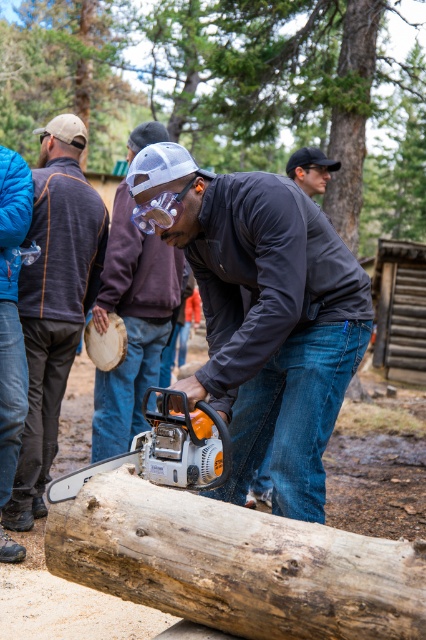
Question: Which point is closer to the camera?

Choices:
 (A) matte white helmet at center
 (B) matte black chainsaw at left
 (C) green textured log at center
 (D) dark gray jacket at center

Answer: (B)

Question: Does green textured log at center appear on the left side of matte black chainsaw at center?

Choices:
 (A) no
 (B) yes

Answer: (B)

Question: Is matte black chainsaw at left closer to camera compared to orange metallic chainsaw at lower center?

Choices:
 (A) no
 (B) yes

Answer: (A)

Question: Estimate the real-world distances between objects in this image. Which object is farther from the dark gray jacket at center?

Choices:
 (A) matte white helmet at center
 (B) green textured log at center

Answer: (B)

Question: Can you confirm if matte black chainsaw at left is wider than matte white helmet at center?

Choices:
 (A) yes
 (B) no

Answer: (B)

Question: Estimate the real-world distances between objects in this image. Which object is closer to the green textured log at center?

Choices:
 (A) weathered brown log at center
 (B) orange metallic chainsaw at lower center

Answer: (A)